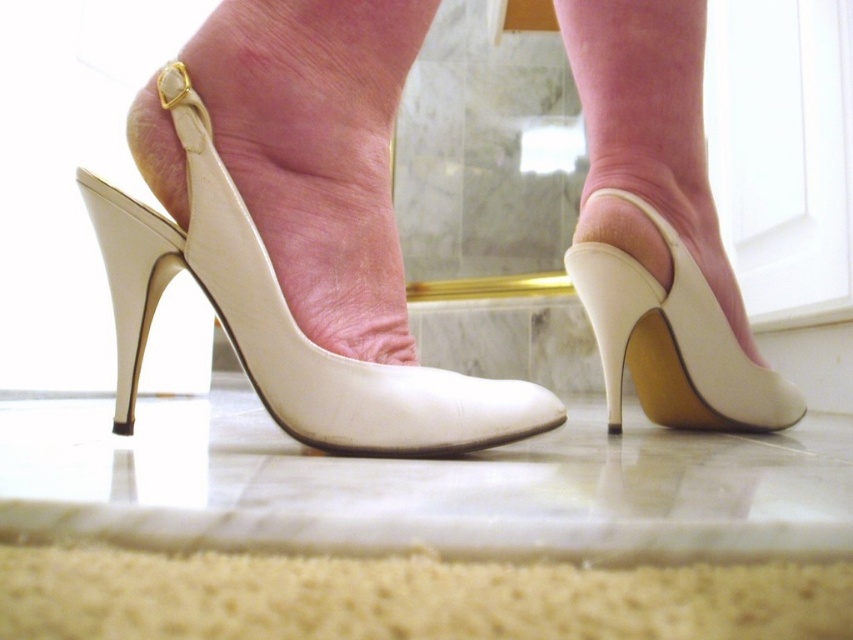
Between point (331, 394) and point (788, 381), which one is positioned behind?

Point (788, 381)

Does white leather shoe at center appear on the right side of white leather high heel at center?

Incorrect, white leather shoe at center is not on the right side of white leather high heel at center.

Locate an element on the screen. This screenshot has width=853, height=640. white leather shoe at center is located at coordinates (315, 342).